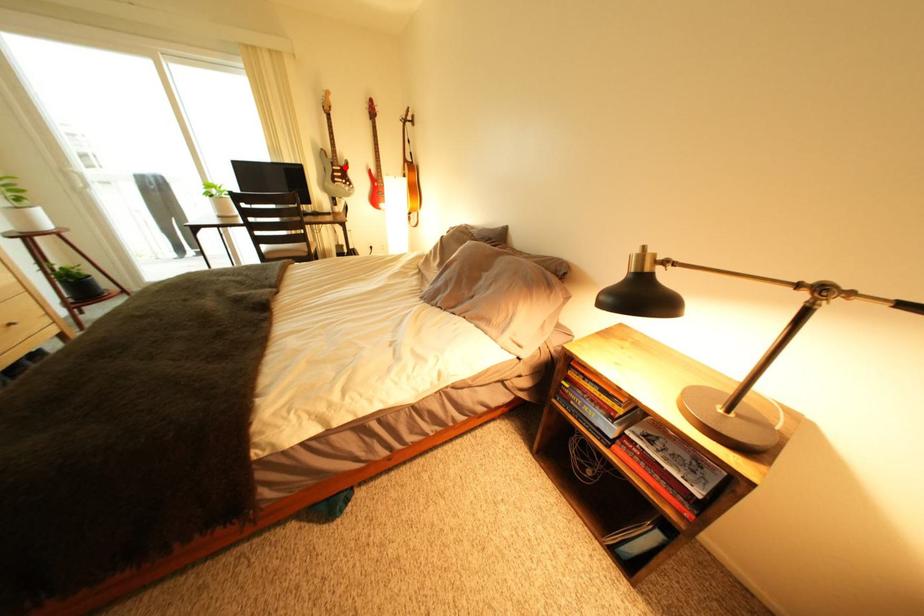
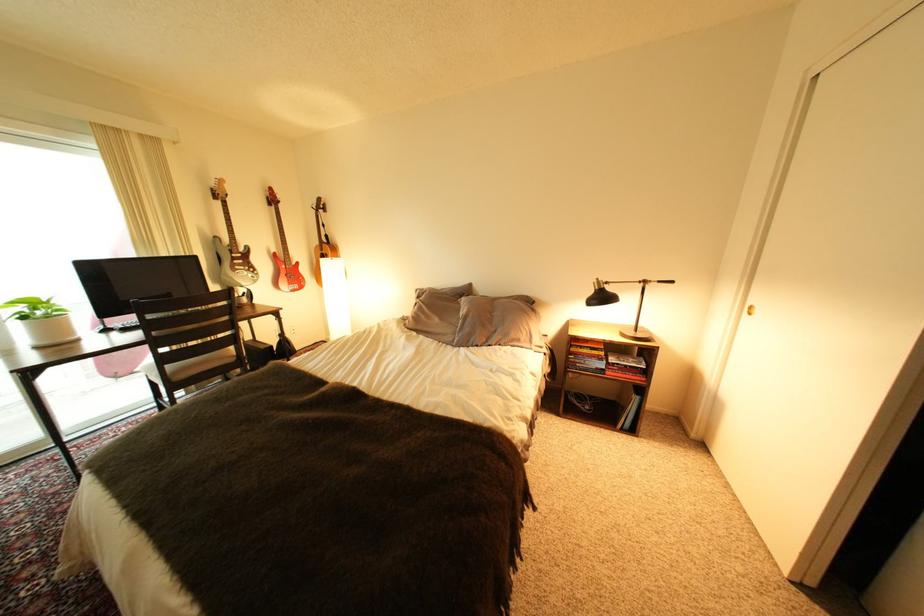
The point at the highlighted location is marked in the first image. Where is the corresponding point in the second image?

(244, 254)